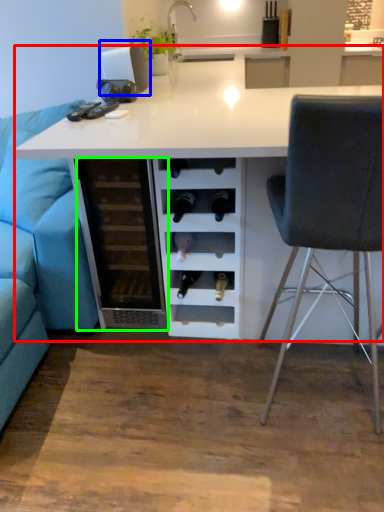
Question: Considering the real-world distances, which object is closest to table (highlighted by a red box)? appliance (highlighted by a blue box) or file cabinet (highlighted by a green box).

Choices:
 (A) appliance
 (B) file cabinet

Answer: (B)